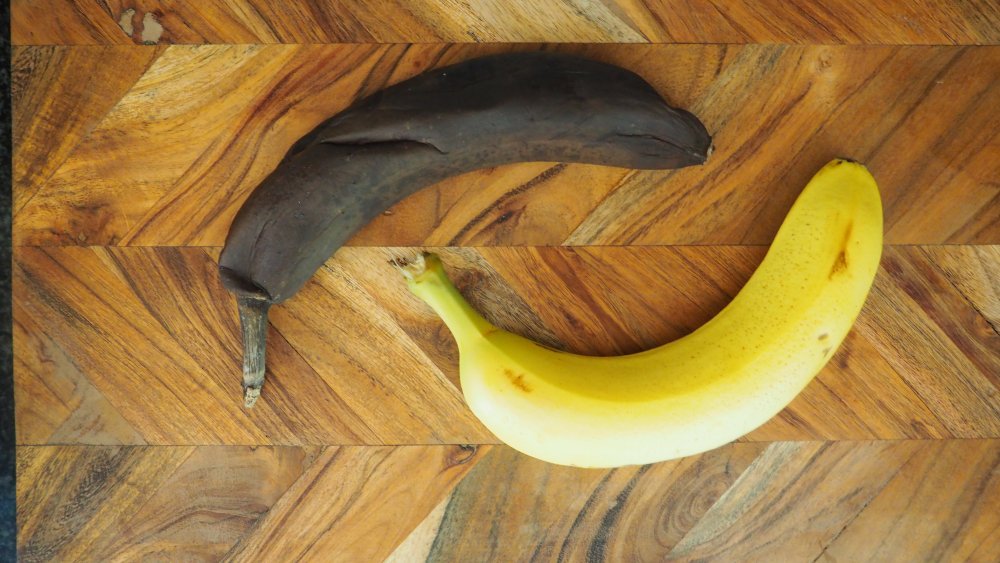
Find the location of a particular element. Image resolution: width=1000 pixels, height=563 pixels. floor is located at coordinates (406, 493).